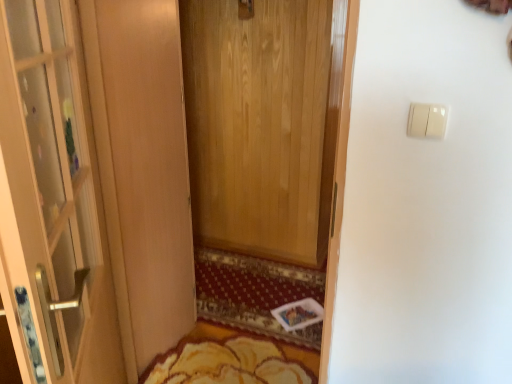
Question: Is yellow floral rug at lower center next to yellow textured rug at center?

Choices:
 (A) yes
 (B) no

Answer: (B)

Question: Considering the relative sizes of yellow floral rug at lower center and yellow textured rug at center in the image provided, is yellow floral rug at lower center smaller than yellow textured rug at center?

Choices:
 (A) no
 (B) yes

Answer: (B)

Question: Can you confirm if yellow floral rug at lower center is positioned to the right of yellow textured rug at center?

Choices:
 (A) yes
 (B) no

Answer: (B)

Question: Is yellow floral rug at lower center positioned in front of yellow textured rug at center?

Choices:
 (A) yes
 (B) no

Answer: (A)

Question: Does yellow floral rug at lower center appear on the left side of yellow textured rug at center?

Choices:
 (A) no
 (B) yes

Answer: (B)

Question: Is yellow floral rug at lower center facing towards yellow textured rug at center?

Choices:
 (A) yes
 (B) no

Answer: (B)

Question: Is yellow floral rug at lower center shorter than white plastic light switch at upper right?

Choices:
 (A) yes
 (B) no

Answer: (A)

Question: Are yellow floral rug at lower center and white plastic light switch at upper right making contact?

Choices:
 (A) no
 (B) yes

Answer: (A)

Question: Is yellow floral rug at lower center wider than white plastic light switch at upper right?

Choices:
 (A) no
 (B) yes

Answer: (B)

Question: Is yellow floral rug at lower center positioned in front of white plastic light switch at upper right?

Choices:
 (A) no
 (B) yes

Answer: (A)

Question: Can you confirm if yellow floral rug at lower center is thinner than white plastic light switch at upper right?

Choices:
 (A) yes
 (B) no

Answer: (B)

Question: Considering the relative sizes of yellow floral rug at lower center and white plastic light switch at upper right in the image provided, is yellow floral rug at lower center bigger than white plastic light switch at upper right?

Choices:
 (A) no
 (B) yes

Answer: (B)

Question: Can you confirm if yellow textured rug at center is taller than white plastic light switch at upper right?

Choices:
 (A) no
 (B) yes

Answer: (A)